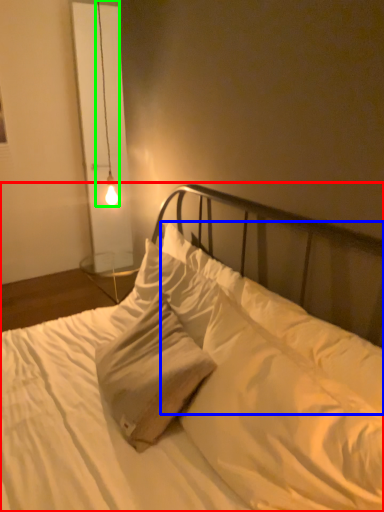
Question: Which object is positioned closest to bed (highlighted by a red box)? Select from pillow (highlighted by a blue box) and lamp (highlighted by a green box).

Choices:
 (A) pillow
 (B) lamp

Answer: (A)